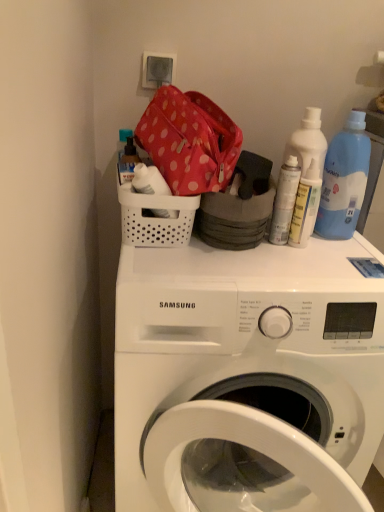
You are a GUI agent. You are given a task and a screenshot of the screen. Output one action in this format:
    pyautogui.click(x=<x>, y=<y>)
    Task: Click on the space that is in front of white matte spray can at upper right, placed as the second bottle when sorted from right to left
    This screenshot has width=384, height=512.
    Given the screenshot: What is the action you would take?
    pyautogui.click(x=286, y=274)